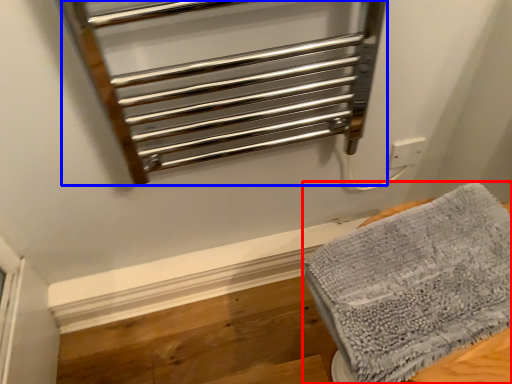
Question: Which point is closer to the camera, towel (highlighted by a red box) or cage (highlighted by a blue box)?

Choices:
 (A) towel
 (B) cage

Answer: (B)